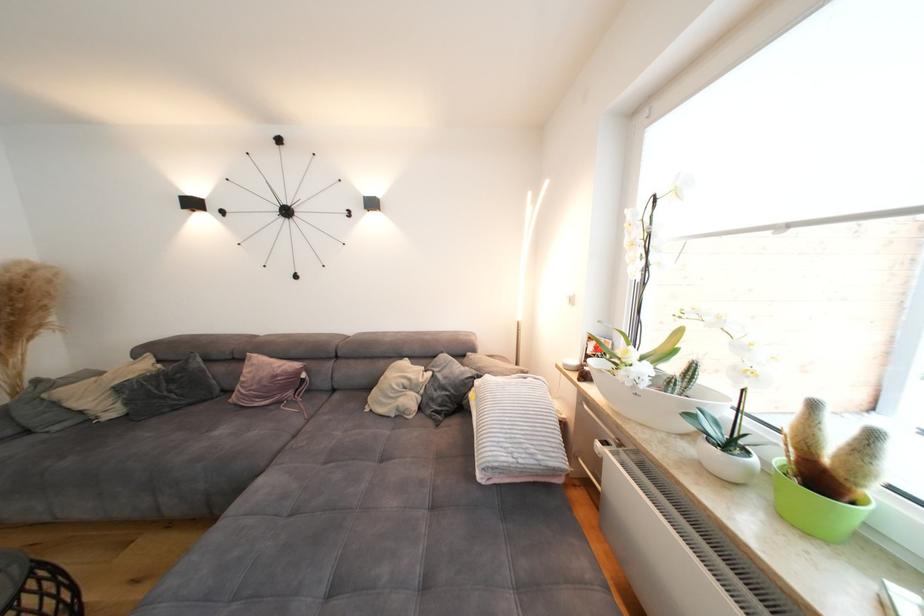
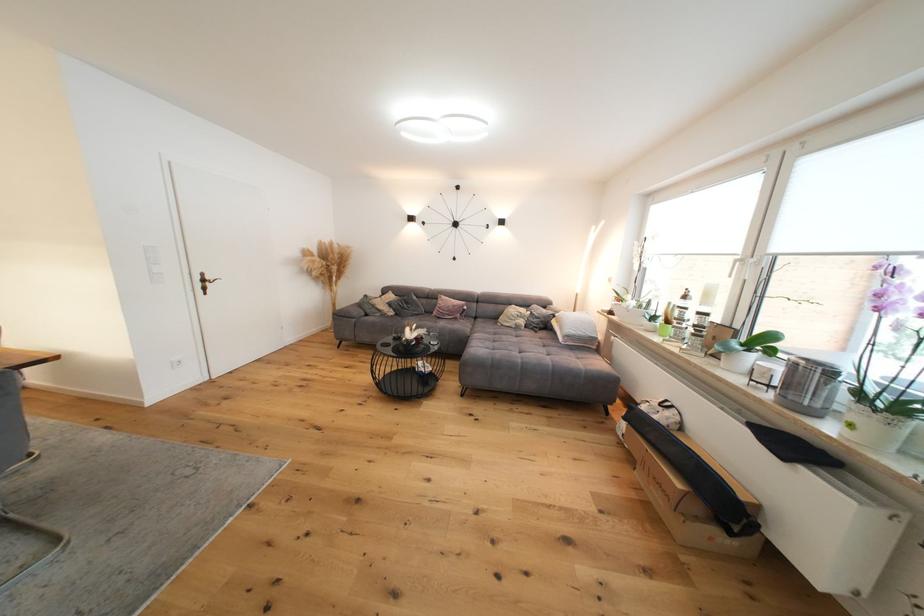
In the second image, find the point that corresponds to (407,418) in the first image.

(524, 330)